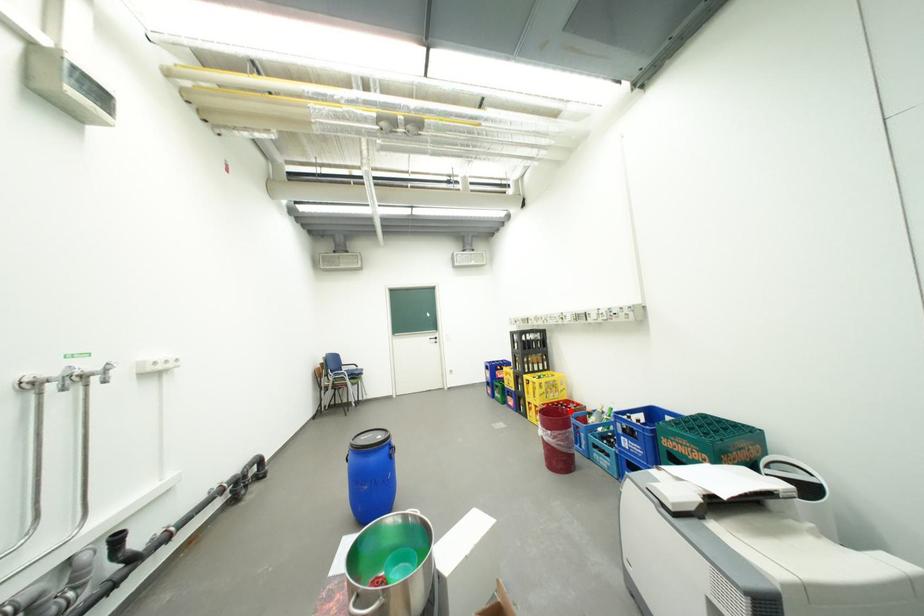
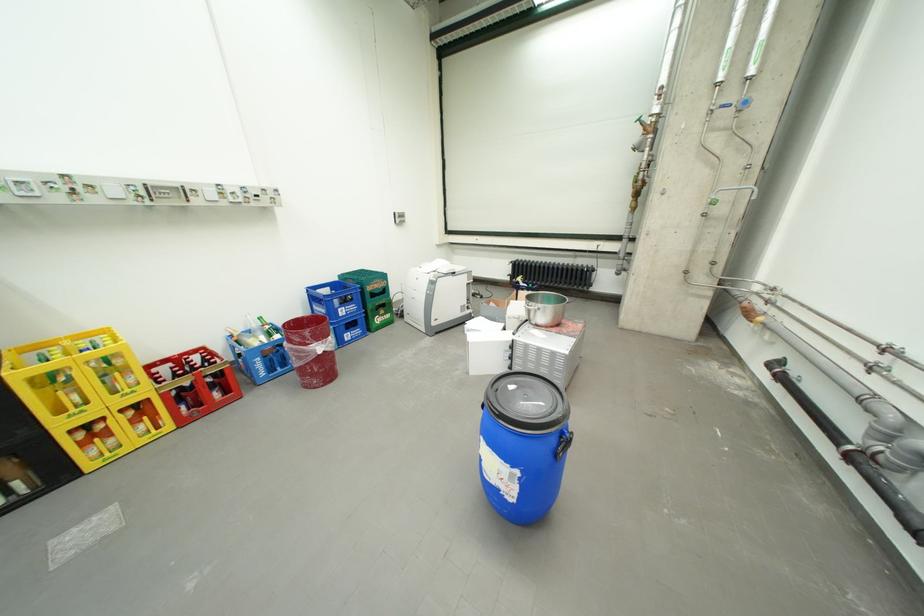
Locate, in the second image, the point that corresponds to the highlighted location in the first image.

(297, 328)